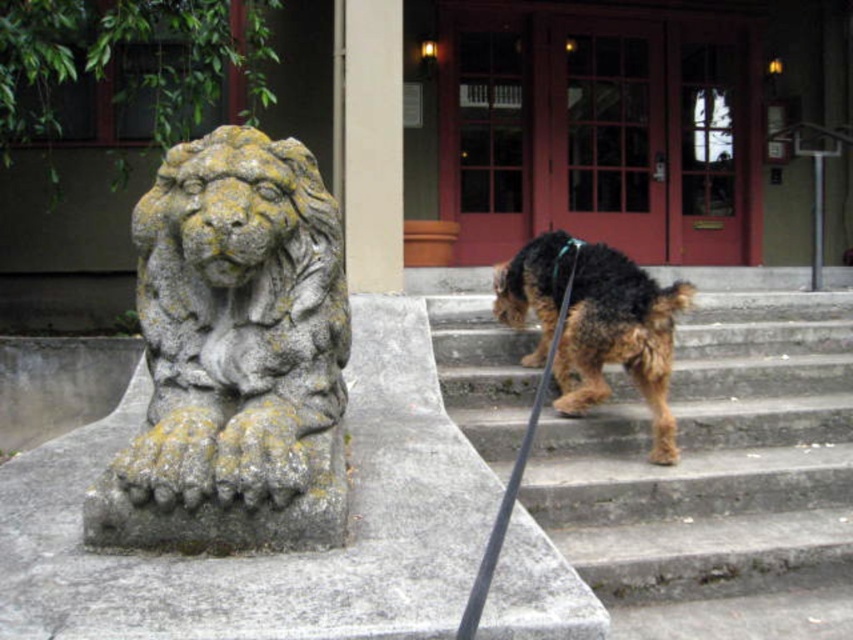
Who is taller, gray stone lion at left or brown shaggy dog at center?

Standing taller between the two is brown shaggy dog at center.

Is the position of gray stone lion at left more distant than that of brown shaggy dog at center?

No, gray stone lion at left is in front of brown shaggy dog at center.

Where is `gray stone lion at left`? This screenshot has width=853, height=640. gray stone lion at left is located at coordinates (234, 355).

Is point (622, 332) positioned behind point (399, 250)?

No, (622, 332) is in front of (399, 250).

What do you see at coordinates (619, 339) in the screenshot? This screenshot has width=853, height=640. I see `brown shaggy dog at center` at bounding box center [619, 339].

Is point (543, 362) positioned behind point (372, 60)?

No, it is not.

The height and width of the screenshot is (640, 853). What are the coordinates of `brown shaggy dog at center` in the screenshot? It's located at (619, 339).

Who is shorter, gray concrete stairs at center or gray stone lion at left?

gray concrete stairs at center

Does point (813, 486) come behind point (308, 278)?

Yes, it is.

Where is `gray concrete stairs at center`? gray concrete stairs at center is located at coordinates (717, 480).